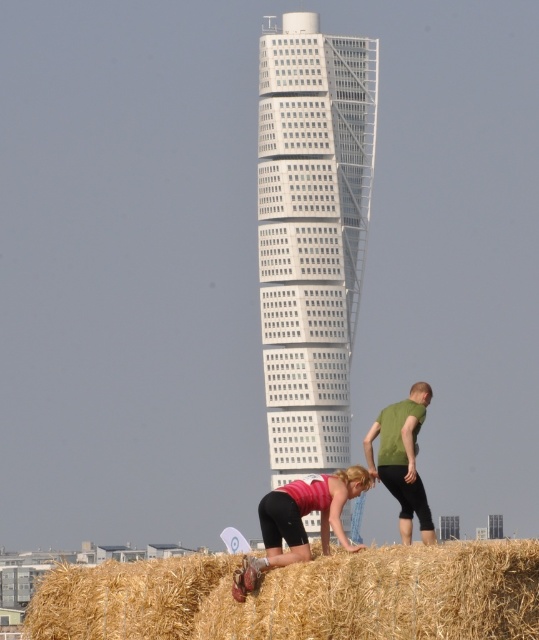
You are a photographer planning to capture the white glass tower at center in the background with the matte pink shirt at lower center in the foreground. Which object should you focus on first if you want to ensure both are in sharp focus?

You should focus on the white glass tower at center first because it is further away than the matte pink shirt at lower center, so adjusting focus from far to near will help both be in sharp focus.

You are standing at the base of the Turning Torso skyscraper and see the green matte shirt at lower right. If you want to take a photo of the shirt and the skyscraper in the background, which direction should you move to ensure both are in frame?

To capture both the green matte shirt at lower right and the Turning Torso skyscraper in the background, you should move to the left. Since the shirt is positioned at coordinates approximately 0.719 on the x and 0.748 on the y axis, moving left would align the shirt within your camera frame while keeping the skyscraper visible in the background.